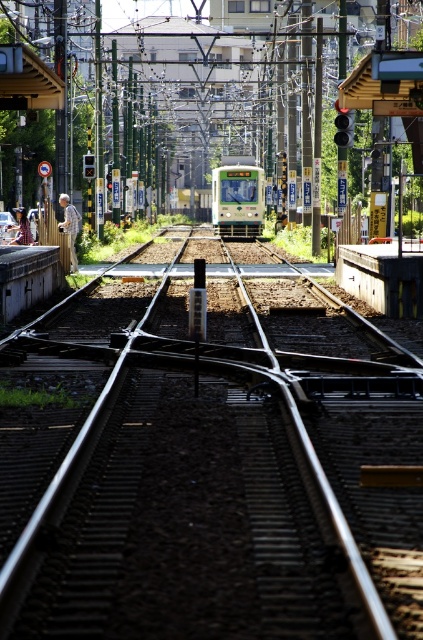
Question: From the image, what is the correct spatial relationship of metallic train tracks at center in relation to green matte train at center?

Choices:
 (A) right
 (B) left

Answer: (B)

Question: Is metallic train tracks at center below green matte train at center?

Choices:
 (A) no
 (B) yes

Answer: (B)

Question: Which object appears farthest from the camera in this image?

Choices:
 (A) metallic train tracks at center
 (B) green matte train at center

Answer: (B)

Question: Which object is farther from the camera taking this photo?

Choices:
 (A) metallic train tracks at center
 (B) green matte train at center

Answer: (B)

Question: Which point appears farthest from the camera in this image?

Choices:
 (A) (329, 577)
 (B) (249, 164)

Answer: (B)

Question: From the image, what is the correct spatial relationship of metallic train tracks at center in relation to green matte train at center?

Choices:
 (A) left
 (B) right

Answer: (A)